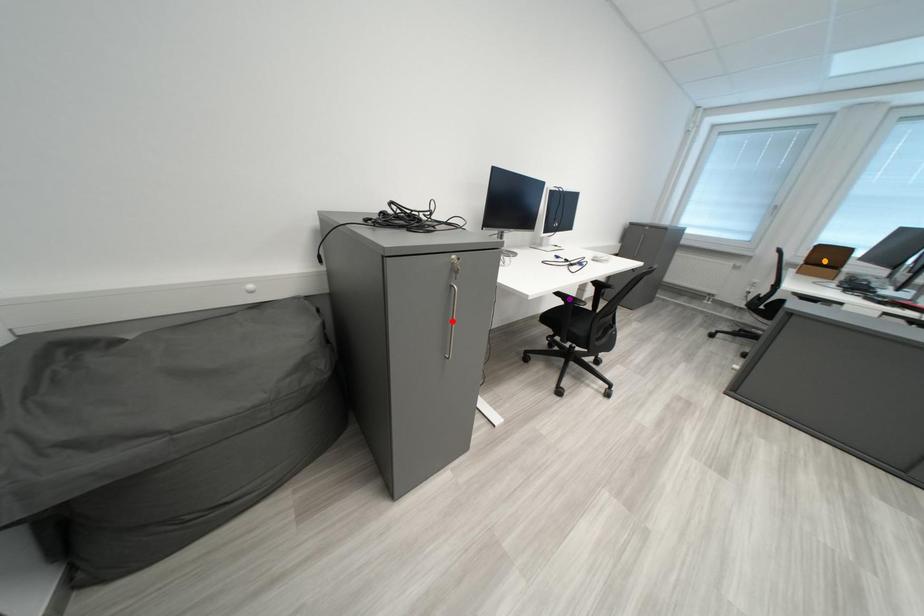
Order these from nearest to farthest:
red point
orange point
purple point

red point < purple point < orange point